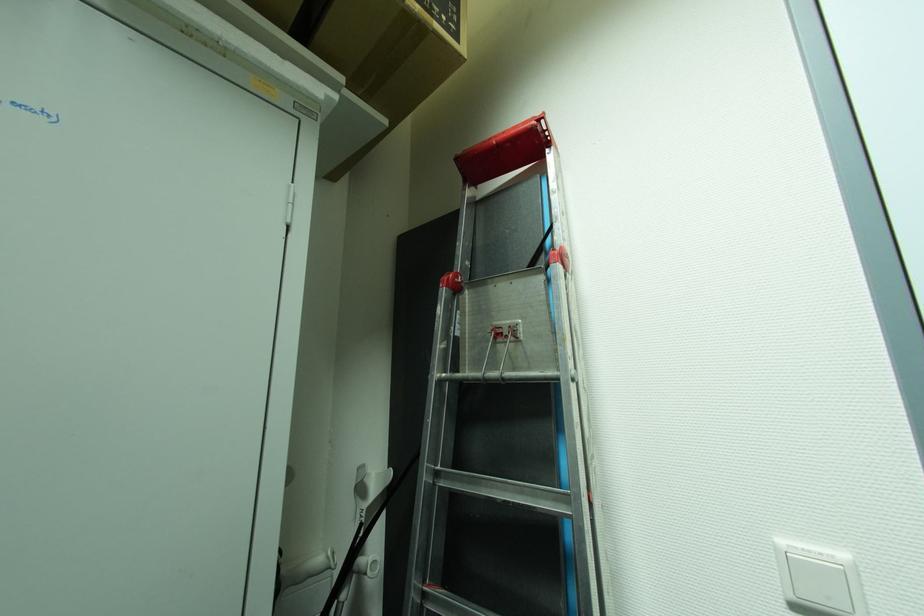
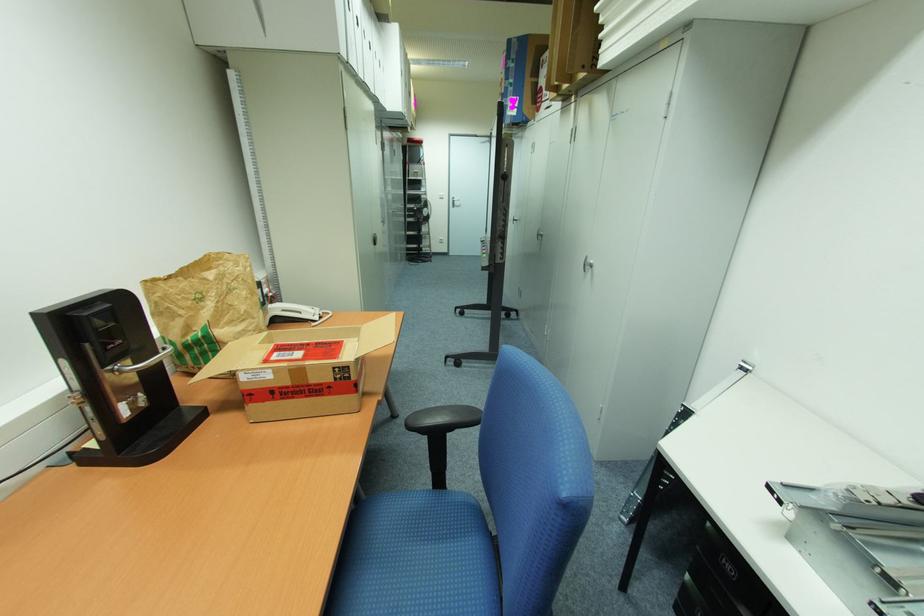
Find the pixel in the second image that matches pixel 551 144 in the first image.

(423, 144)